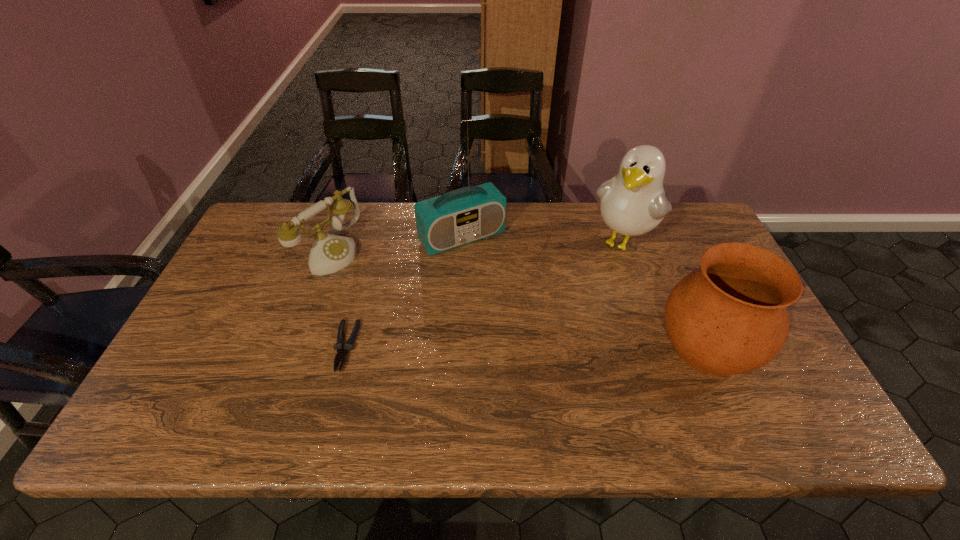
Where is `vacant space located on the dial of the second shortest object`? vacant space located on the dial of the second shortest object is located at coordinates (388, 289).

The image size is (960, 540). I want to click on free space located 0.160m on the front panel of the third object from left to right, so [507, 290].

Find the location of a particular element. The height and width of the screenshot is (540, 960). free space located on the front panel of the third object from left to right is located at coordinates (533, 325).

Locate an element on the screen. The width and height of the screenshot is (960, 540). vacant space situated on the front panel of the third object from left to right is located at coordinates (517, 304).

Locate an element on the screen. Image resolution: width=960 pixels, height=540 pixels. blank space located 0.320m on the beak of the gull is located at coordinates (557, 332).

You are a GUI agent. You are given a task and a screenshot of the screen. Output one action in this format:
    pyautogui.click(x=<x>, y=<y>)
    Task: Click on the vacant area situated 0.400m on the beak of the gull
    This screenshot has width=960, height=540.
    Given the screenshot: What is the action you would take?
    pyautogui.click(x=541, y=353)

The width and height of the screenshot is (960, 540). I want to click on vacant space located on the beak of the gull, so click(x=543, y=350).

Find the location of `telephone located in the far edge section of the desktop`. telephone located in the far edge section of the desktop is located at coordinates (329, 253).

This screenshot has height=540, width=960. I want to click on radio receiver positioned at the far edge, so click(458, 217).

What are the coordinates of `gull that is at the far edge` in the screenshot? It's located at (632, 203).